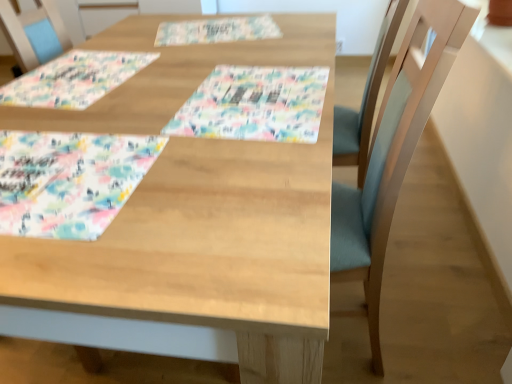
At what (x,y) coordinates should I click in order to perform the action: click on free space between pastel floral fabric placemat at lower left, which ranks as the 3th place mat in back-to-front order, and floral paper placemat at upper center, which is counted as the third place mat, starting from the front. Please return your answer as a coordinate pair (x, y). This screenshot has height=384, width=512. Looking at the image, I should click on (158, 83).